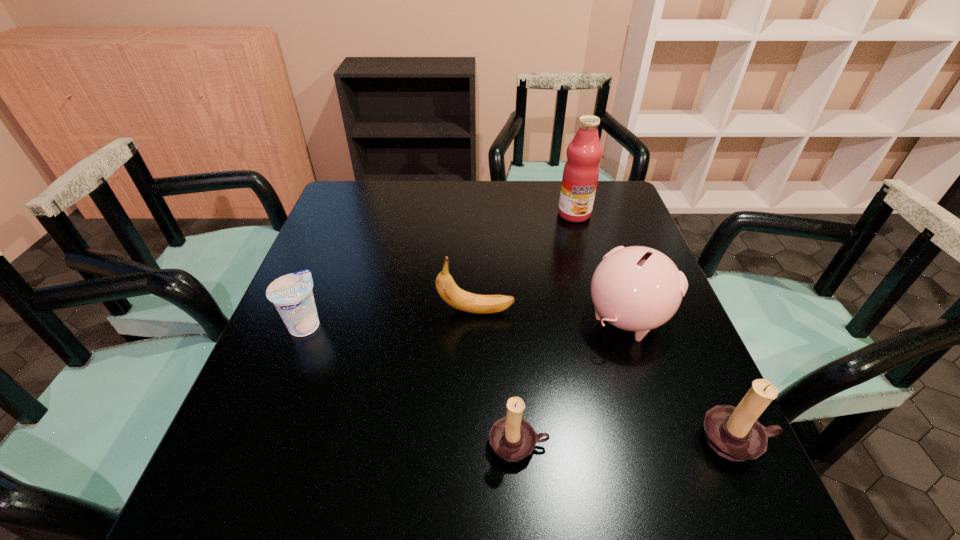
Find the location of a particular element. the left candle holder is located at coordinates (512, 438).

The width and height of the screenshot is (960, 540). In order to click on the taller candle holder in this screenshot , I will do `click(734, 433)`.

Image resolution: width=960 pixels, height=540 pixels. What are the coordinates of `the tallest object` in the screenshot? It's located at (581, 171).

The image size is (960, 540). What are the coordinates of `fruit juice` in the screenshot? It's located at (581, 171).

At what (x,y) coordinates should I click in order to perform the action: click on banana. Please return your answer as a coordinate pair (x, y). The width and height of the screenshot is (960, 540). Looking at the image, I should click on (456, 297).

I want to click on piggy bank, so click(x=636, y=288).

Identify the location of the shortest object. The width and height of the screenshot is (960, 540). (291, 294).

Image resolution: width=960 pixels, height=540 pixels. Identify the location of the leftmost object. (291, 294).

At what (x,y) coordinates should I click in order to perform the action: click on vacant region located on the label of the fruit juice. Please return your answer as a coordinate pair (x, y). Looking at the image, I should click on (589, 267).

Find the location of a particular element. The image size is (960, 540). vacant region located at the start of the peel on the banana is located at coordinates (614, 311).